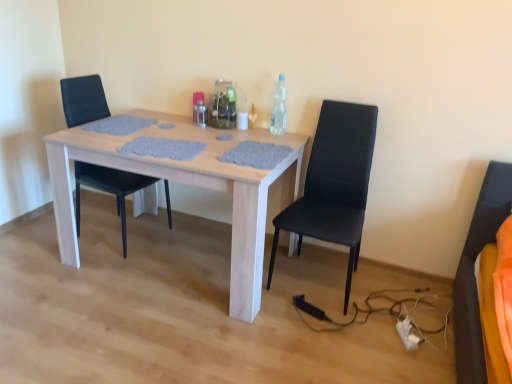
The width and height of the screenshot is (512, 384). Find the location of `vacant space in front of black leather chair at right, arranged as the second chair when viewed from the left`. vacant space in front of black leather chair at right, arranged as the second chair when viewed from the left is located at coordinates (327, 340).